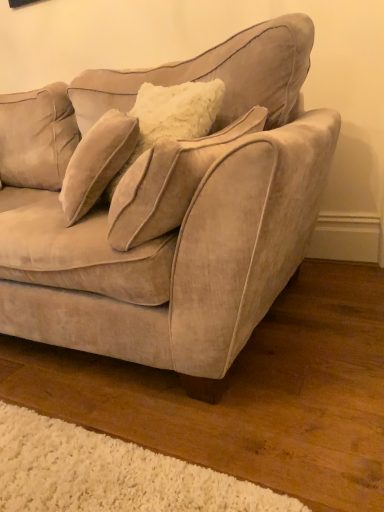
What do you see at coordinates (170, 212) in the screenshot?
I see `suede couch at center` at bounding box center [170, 212].

Image resolution: width=384 pixels, height=512 pixels. I want to click on suede couch at center, so [170, 212].

Consider the image. Measure the distance between point (x=228, y=94) and camera.

The distance of point (x=228, y=94) from camera is 4.64 feet.

In order to face suede couch at center, should I rotate leftwards or rightwards?

Rotate left and turn 19.224 degrees.

This screenshot has height=512, width=384. What are the coordinates of `suede couch at center` in the screenshot? It's located at (170, 212).